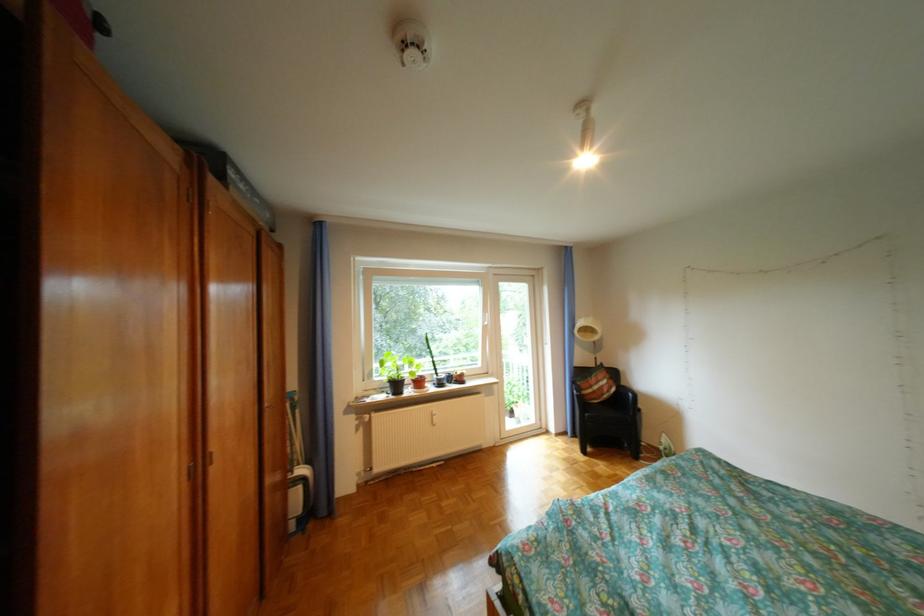
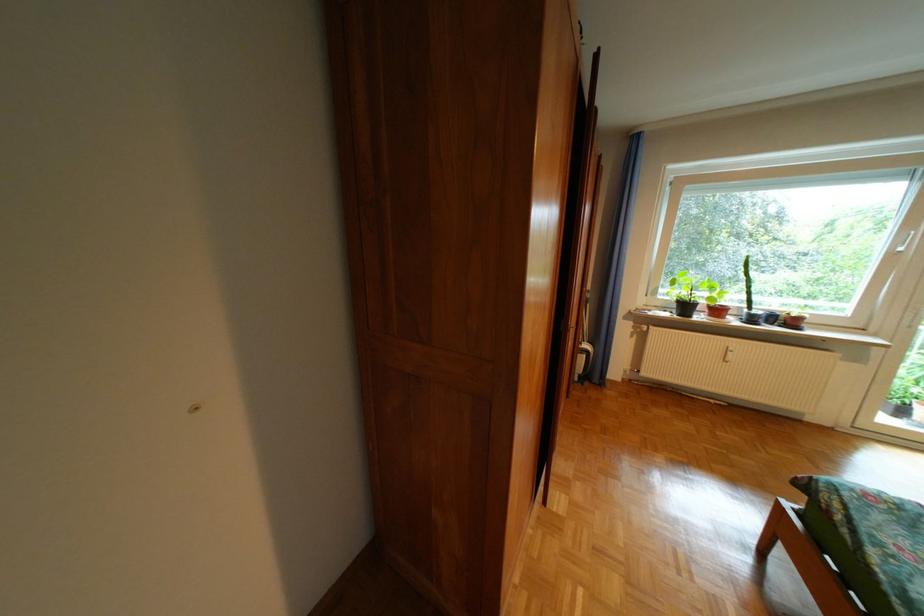
Find the pixel in the second image that matches [499,321] in the first image.

(912, 245)